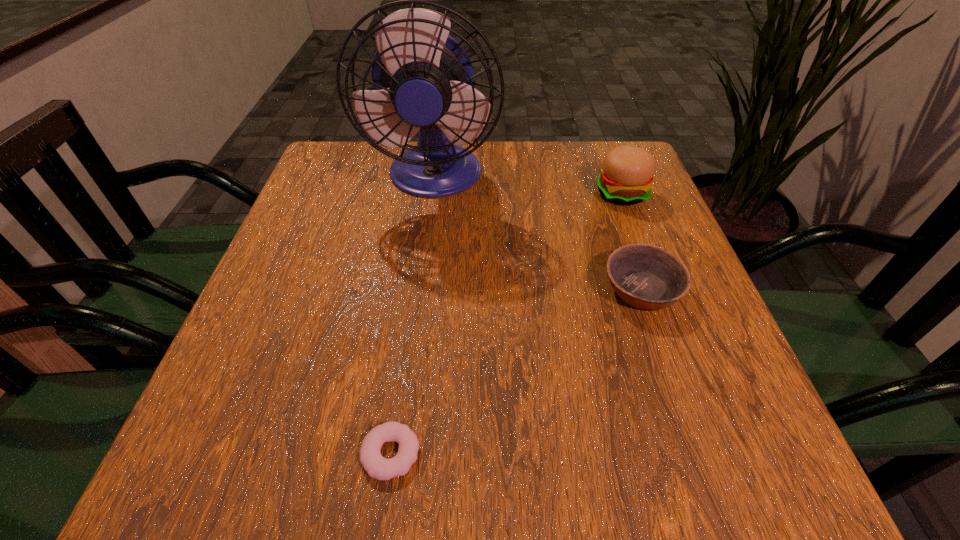
Locate an element on the screen. This screenshot has height=540, width=960. fan is located at coordinates (423, 80).

Find the location of a particular element. The image size is (960, 540). the second tallest object is located at coordinates (626, 178).

At what (x,y) coordinates should I click in order to perform the action: click on bowl. Please return your answer as a coordinate pair (x, y). The width and height of the screenshot is (960, 540). Looking at the image, I should click on [647, 277].

At what (x,y) coordinates should I click in order to perform the action: click on the third tallest object. Please return your answer as a coordinate pair (x, y). Looking at the image, I should click on (647, 277).

At what (x,y) coordinates should I click in order to perform the action: click on doughnut. Please return your answer as a coordinate pair (x, y). Image resolution: width=960 pixels, height=540 pixels. Looking at the image, I should click on (376, 466).

The width and height of the screenshot is (960, 540). In order to click on the nearest object in this screenshot , I will do `click(376, 466)`.

I want to click on free region located 0.360m in front of the fan where the airflow is directed, so click(413, 350).

The height and width of the screenshot is (540, 960). I want to click on free space located on the left of the third shortest object, so click(x=507, y=193).

At what (x,y) coordinates should I click in order to perform the action: click on free space located 0.270m on the left of the bowl. Please return your answer as a coordinate pair (x, y). The width and height of the screenshot is (960, 540). Looking at the image, I should click on (458, 290).

Where is `vacant space positioned 0.320m on the back of the shortest object`? The height and width of the screenshot is (540, 960). vacant space positioned 0.320m on the back of the shortest object is located at coordinates (417, 270).